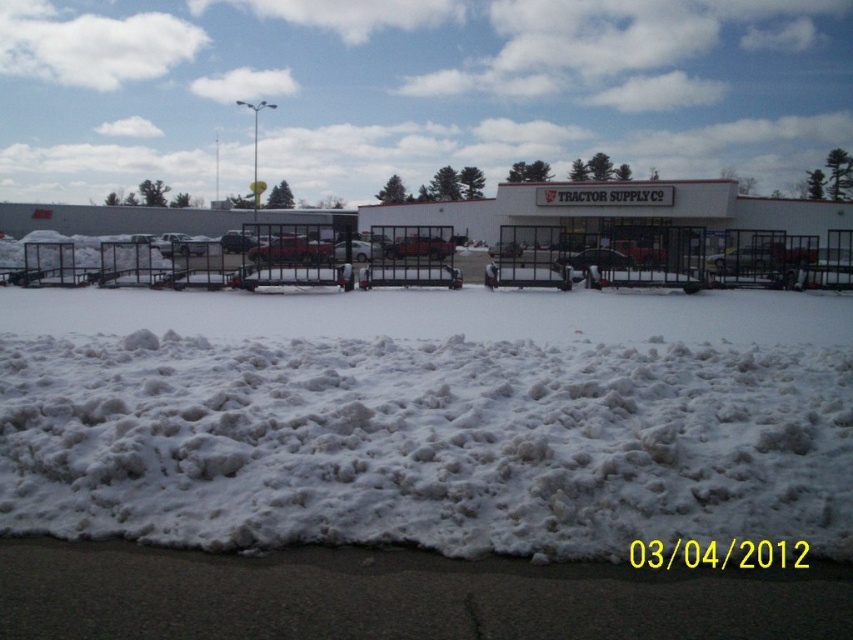
You are a delivery driver arriving at the Tractor Supply Co. store. You need to park your matte red truck at center on the white fluffy snow at lower center. Is there enough space for the truck to park on the snow?

The white fluffy snow at lower center is positioned under the matte red truck at center, which means the truck is already parked there. Therefore, there is enough space for the truck to park on the snow.

You are a delivery driver who needs to park your truck at the Tractor Supply Co. store. The parking lot has a cleared area with packed snow. Where is the white fluffy snow at lower center located in relation to the parking lot? Is it a suitable spot for parking?

The white fluffy snow at lower center is located at coordinates point (424, 444). Since the parking lot area has been cleared and the snow there is packed, the white fluffy snow at lower center might not be a suitable parking spot as fluffy snow could indicate less compacted or deeper snow which may not support the truck.

You are standing at the entrance of the Tractor Supply Co. store and see the matte red truck at center and the metallic silver sedan at center. Which vehicle is closer to the parking lot pavement?

The matte red truck at center is closer to the parking lot pavement because it is located below the metallic silver sedan at center, meaning it is positioned lower in the image and thus nearer to the pavement area shown at the bottom edge of the frame.